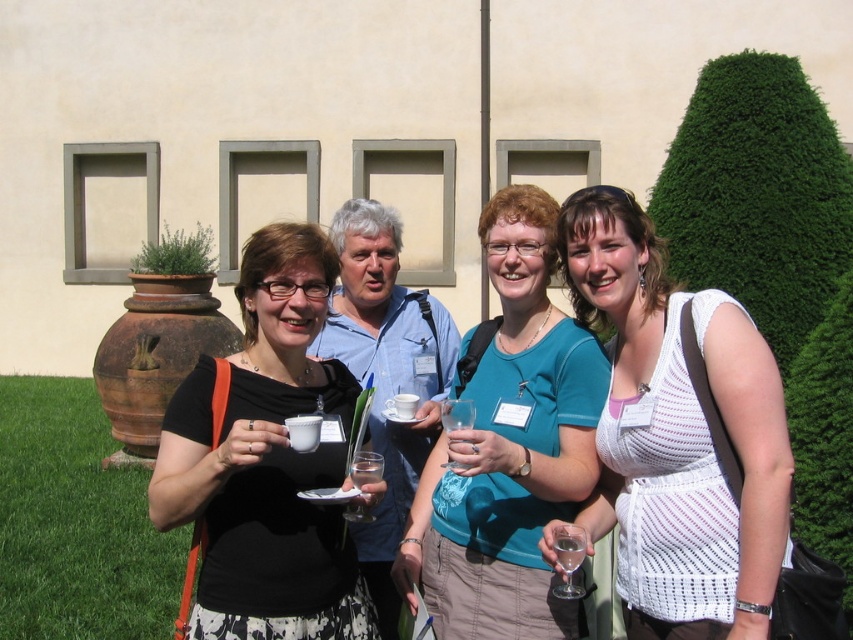
Question: Which point appears closest to the camera in this image?

Choices:
 (A) pos(570,328)
 (B) pos(462,467)

Answer: (B)

Question: Estimate the real-world distances between objects in this image. Which object is farther from the clear glass at center?

Choices:
 (A) white knitted tank top at center
 (B) transparent glass at lower right
 (C) black matte cup at center

Answer: (A)

Question: Where is teal fabric shirt at center located in relation to transparent glass at lower right in the image?

Choices:
 (A) below
 (B) above

Answer: (B)

Question: Can you confirm if white knitted tank top at center is smaller than black matte cup at center?

Choices:
 (A) yes
 (B) no

Answer: (B)

Question: Can you confirm if green grass at lower left is wider than transparent glass at lower right?

Choices:
 (A) no
 (B) yes

Answer: (B)

Question: Which point is farther to the camera?

Choices:
 (A) (451, 429)
 (B) (537, 218)
 (C) (51, 621)

Answer: (C)